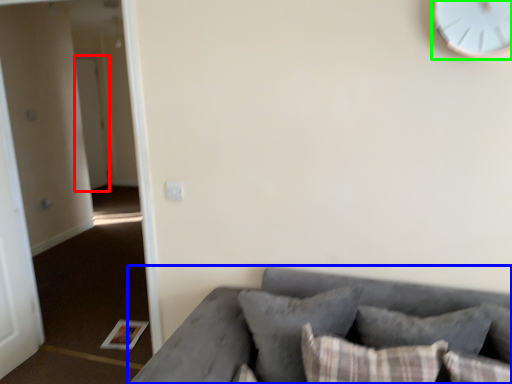
Question: Based on their relative distances, which object is farther from door (highlighted by a red box)? Choose from studio couch (highlighted by a blue box) and clock (highlighted by a green box).

Choices:
 (A) studio couch
 (B) clock

Answer: (B)